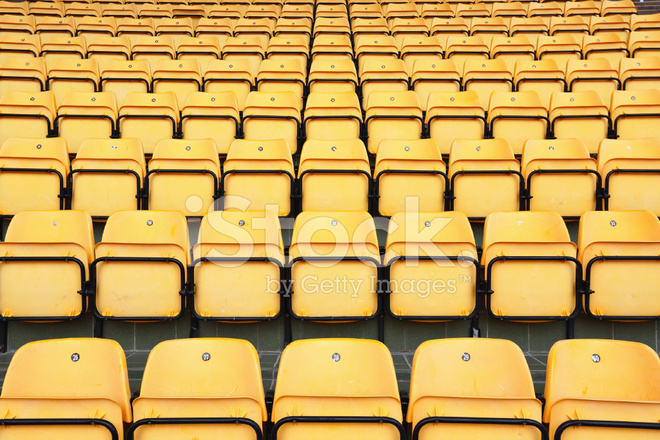
Find the location of a particular element. 1st row seats is located at coordinates (73, 387), (231, 378), (337, 383), (457, 382), (608, 381).